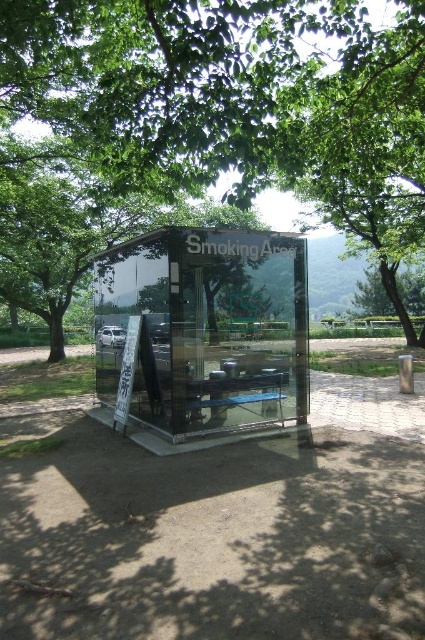
Question: Does green leafy tree at center have a smaller size compared to transparent glass smoking area at center?

Choices:
 (A) yes
 (B) no

Answer: (B)

Question: Which object appears farthest from the camera in this image?

Choices:
 (A) transparent glass smoking area at center
 (B) green leafy tree at center

Answer: (A)

Question: Can you confirm if green leafy tree at center is positioned to the left of transparent glass smoking area at center?

Choices:
 (A) yes
 (B) no

Answer: (A)

Question: Which point is farther to the camera?

Choices:
 (A) (283, 12)
 (B) (277, 282)

Answer: (B)

Question: Is green leafy tree at center above transparent glass smoking area at center?

Choices:
 (A) yes
 (B) no

Answer: (A)